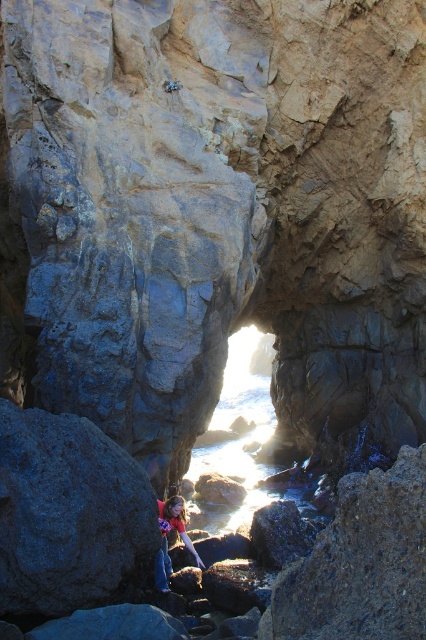
You are a hiker standing at the base of the coastal rocks. You see the translucent water at center and the matte red shirt at lower center. Which object is taller?

The translucent water at center has a greater height compared to the matte red shirt at lower center, so the translucent water at center is taller.